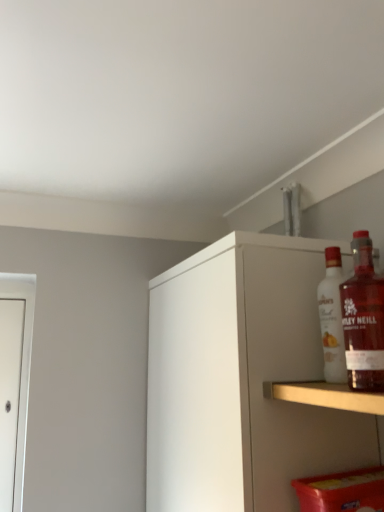
Question: In the image, is white matte cabinet at upper right on the left side or the right side of translucent glass bottle at upper right, which ranks as the 2th bottle in back-to-front order?

Choices:
 (A) left
 (B) right

Answer: (A)

Question: In the image, is white matte cabinet at upper right positioned in front of or behind translucent glass bottle at upper right, which ranks as the 2th bottle in back-to-front order?

Choices:
 (A) behind
 (B) front

Answer: (A)

Question: Which is farther from the white matte cabinet at upper right?

Choices:
 (A) translucent glass bottle at upper right, which ranks as the 2th bottle in back-to-front order
 (B) white glass bottle at upper right, the first bottle when ordered from back to front

Answer: (A)

Question: Which of these objects is positioned farthest from the white matte cabinet at upper right?

Choices:
 (A) translucent glass bottle at upper right, the 1th bottle viewed from the front
 (B) white glass bottle at upper right, the first bottle when ordered from back to front

Answer: (A)